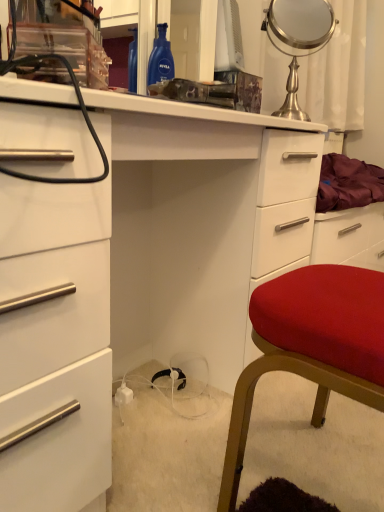
What is the approximate width of polished silver mirror at upper right?

4.66 inches.

The height and width of the screenshot is (512, 384). What do you see at coordinates (297, 40) in the screenshot? I see `polished silver mirror at upper right` at bounding box center [297, 40].

I want to click on polished silver mirror at upper right, so click(x=297, y=40).

Find the location of `polished silver mirror at upper right`. polished silver mirror at upper right is located at coordinates (297, 40).